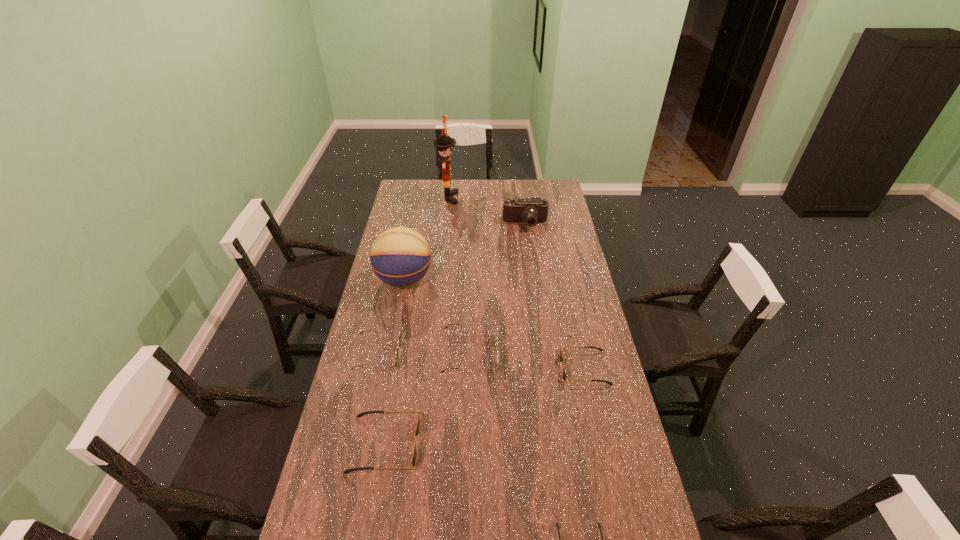
Where is `object that is at the far edge`? Image resolution: width=960 pixels, height=540 pixels. object that is at the far edge is located at coordinates (445, 144).

At what (x,y) coordinates should I click in order to perform the action: click on basketball present at the left edge. Please return your answer as a coordinate pair (x, y). Looking at the image, I should click on (400, 256).

Where is `camera located at the right edge`? This screenshot has height=540, width=960. camera located at the right edge is located at coordinates (533, 210).

Image resolution: width=960 pixels, height=540 pixels. What are the coordinates of `sunglasses located in the right edge section of the desktop` in the screenshot? It's located at (561, 358).

Where is `vacant area at the far edge of the desktop`? vacant area at the far edge of the desktop is located at coordinates (519, 196).

Identify the location of free region at the left edge of the desktop. Image resolution: width=960 pixels, height=540 pixels. (376, 469).

Locate an element on the screen. This screenshot has height=540, width=960. vacant space at the right edge is located at coordinates (587, 433).

Find the location of a particular element. vacant region at the far left corner of the desktop is located at coordinates (400, 191).

Locate an element on the screen. free space between the basketball and the camera is located at coordinates (465, 252).

You are a GUI agent. You are given a task and a screenshot of the screen. Output one action in this format:
    pyautogui.click(x=<x>, y=<y>)
    Task: Click on the unoccupied area between the eighth shortest object and the third nearest object
    
    Given the screenshot: What is the action you would take?
    pyautogui.click(x=395, y=362)